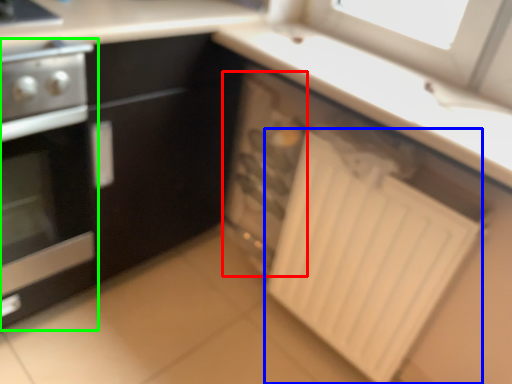
Question: Estimate the real-world distances between objects in this image. Which object is closer to appliance (highlighted by a red box), radiator (highlighted by a blue box) or home appliance (highlighted by a green box)?

Choices:
 (A) radiator
 (B) home appliance

Answer: (A)